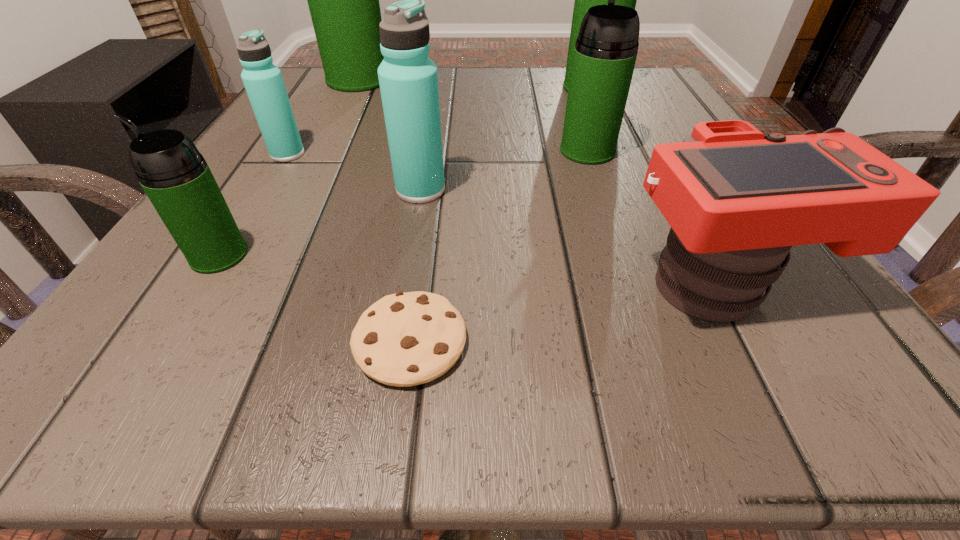
Locate an element on the screen. vacant space located on the back of the fifth farthest thermos bottle is located at coordinates (426, 156).

Where is `blank space located on the back of the smaller aqua thermos bottle`? The image size is (960, 540). blank space located on the back of the smaller aqua thermos bottle is located at coordinates (341, 66).

Locate an element on the screen. Image resolution: width=960 pixels, height=540 pixels. vacant space situated 0.340m on the left of the camera is located at coordinates (327, 281).

The width and height of the screenshot is (960, 540). Find the location of `vacant area situated on the back of the brown cookie`. vacant area situated on the back of the brown cookie is located at coordinates (421, 263).

Where is `camera at the near edge`? This screenshot has width=960, height=540. camera at the near edge is located at coordinates (737, 200).

At what (x,y) coordinates should I click in order to perform the action: click on cookie located at the near edge. Please return your answer as a coordinate pair (x, y). Looking at the image, I should click on (405, 339).

What are the coordinates of `thermos bottle at the right edge` in the screenshot? It's located at (584, 0).

Identify the location of camera located at the right edge. (737, 200).

This screenshot has width=960, height=540. I want to click on object that is at the far left corner, so click(x=343, y=0).

At what (x,y) coordinates should I click in order to perform the action: click on object that is at the far right corner. Please return your answer as a coordinate pair (x, y). Looking at the image, I should click on (584, 0).